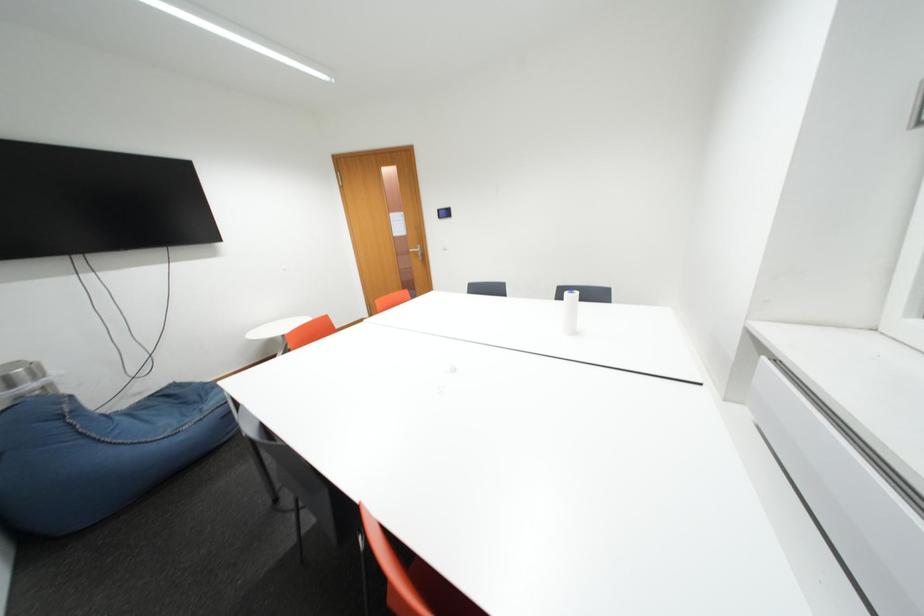
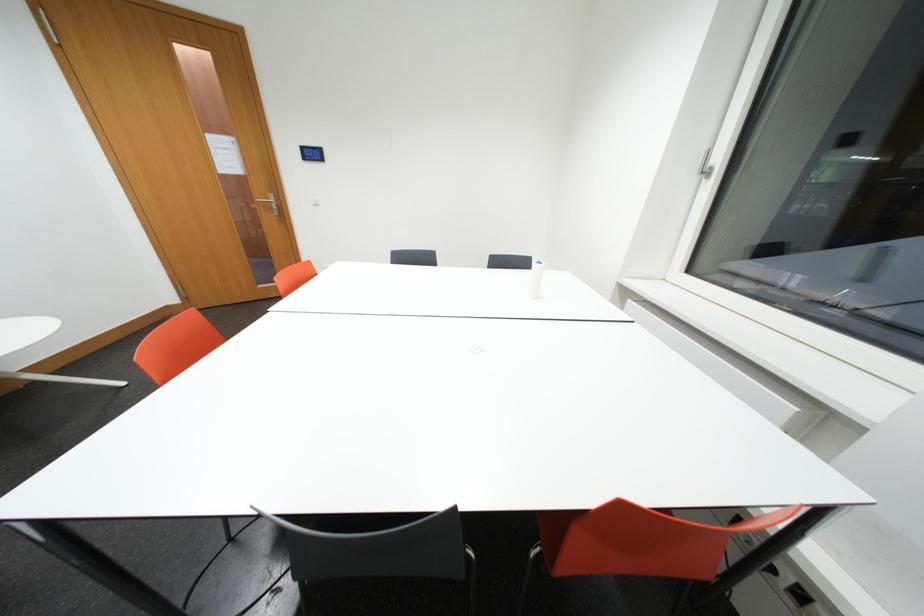
Question: The camera is either moving clockwise (left) or counter-clockwise (right) around the object. The first image is from the beginning of the video and the second image is from the end. Is the camera moving left or right when shooting the video?

Choices:
 (A) Left
 (B) Right

Answer: (A)